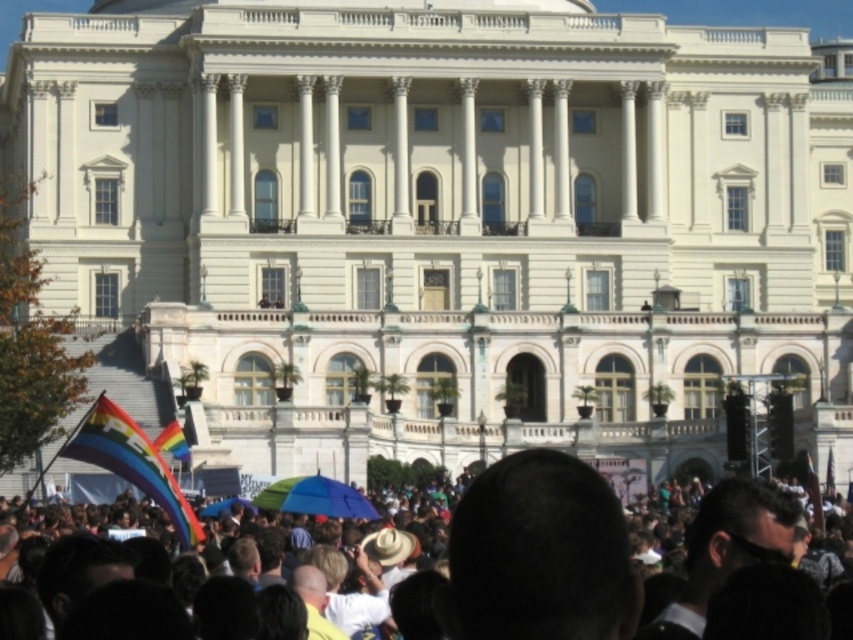
Question: Considering the relative positions of rainbow fabric crowd at lower center and rainbow fabric umbrella at center in the image provided, where is rainbow fabric crowd at lower center located with respect to rainbow fabric umbrella at center?

Choices:
 (A) above
 (B) below

Answer: (A)

Question: Does rainbow fabric crowd at lower center have a larger size compared to rainbow fabric umbrella at center?

Choices:
 (A) yes
 (B) no

Answer: (A)

Question: Which point is closer to the camera?

Choices:
 (A) rainbow fabric crowd at lower center
 (B) rainbow fabric umbrella at center

Answer: (A)

Question: Is rainbow fabric crowd at lower center to the right of rainbow fabric umbrella at center from the viewer's perspective?

Choices:
 (A) no
 (B) yes

Answer: (B)